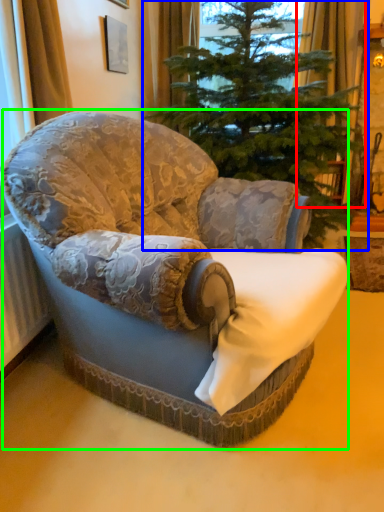
Question: Which is nearer to the curtain (highlighted by a red box)? christmas tree (highlighted by a blue box) or chair (highlighted by a green box).

Choices:
 (A) christmas tree
 (B) chair

Answer: (A)